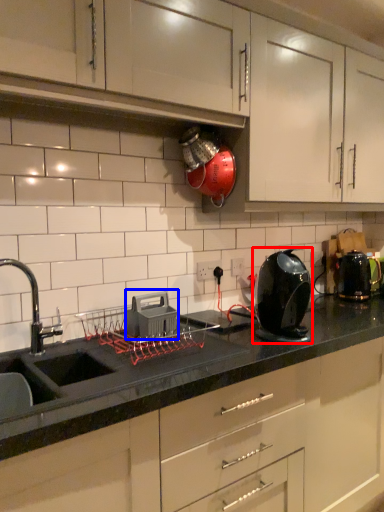
Question: Among these objects, which one is farthest to the camera, home appliance (highlighted by a red box) or appliance (highlighted by a blue box)?

Choices:
 (A) home appliance
 (B) appliance

Answer: (B)